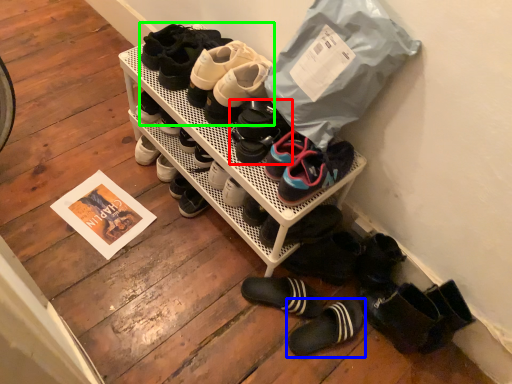
Question: Based on their relative distances, which object is farther from footwear (highlighted by a red box)? Choose from footwear (highlighted by a blue box) and footwear (highlighted by a green box).

Choices:
 (A) footwear
 (B) footwear

Answer: (A)